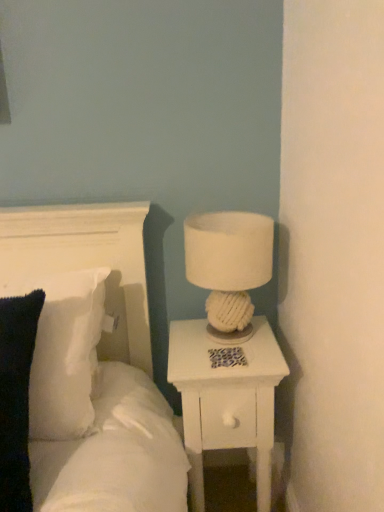
Question: Does white soft pillow at upper left have a greater width compared to white fabric lampshade at upper right?

Choices:
 (A) no
 (B) yes

Answer: (B)

Question: From the image's perspective, is white soft pillow at upper left on top of white fabric lampshade at upper right?

Choices:
 (A) no
 (B) yes

Answer: (A)

Question: Is white soft pillow at upper left not inside white fabric lampshade at upper right?

Choices:
 (A) yes
 (B) no

Answer: (A)

Question: Can you confirm if white soft pillow at upper left is thinner than white fabric lampshade at upper right?

Choices:
 (A) no
 (B) yes

Answer: (A)

Question: Does white soft pillow at upper left come behind white fabric lampshade at upper right?

Choices:
 (A) yes
 (B) no

Answer: (B)

Question: Considering the relative sizes of white soft pillow at upper left and white fabric lampshade at upper right in the image provided, is white soft pillow at upper left bigger than white fabric lampshade at upper right?

Choices:
 (A) yes
 (B) no

Answer: (A)

Question: Considering the relative sizes of white soft pillow at left and white fabric lampshade at upper right in the image provided, is white soft pillow at left wider than white fabric lampshade at upper right?

Choices:
 (A) yes
 (B) no

Answer: (A)

Question: Is white soft pillow at left further to the viewer compared to white fabric lampshade at upper right?

Choices:
 (A) yes
 (B) no

Answer: (B)

Question: Can you confirm if white soft pillow at left is thinner than white fabric lampshade at upper right?

Choices:
 (A) yes
 (B) no

Answer: (B)

Question: From a real-world perspective, is white soft pillow at left over white fabric lampshade at upper right?

Choices:
 (A) yes
 (B) no

Answer: (B)

Question: Is white fabric lampshade at upper right located within white soft pillow at left?

Choices:
 (A) no
 (B) yes

Answer: (A)

Question: Does white soft pillow at left lie in front of white fabric lampshade at upper right?

Choices:
 (A) yes
 (B) no

Answer: (A)

Question: Is white soft pillow at left at the back of white soft pillow at upper left?

Choices:
 (A) no
 (B) yes

Answer: (B)